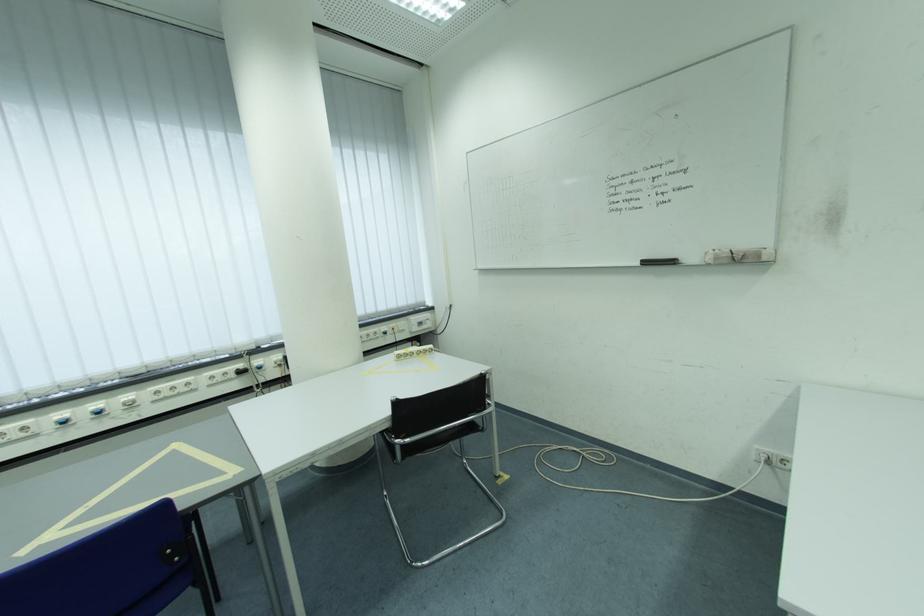
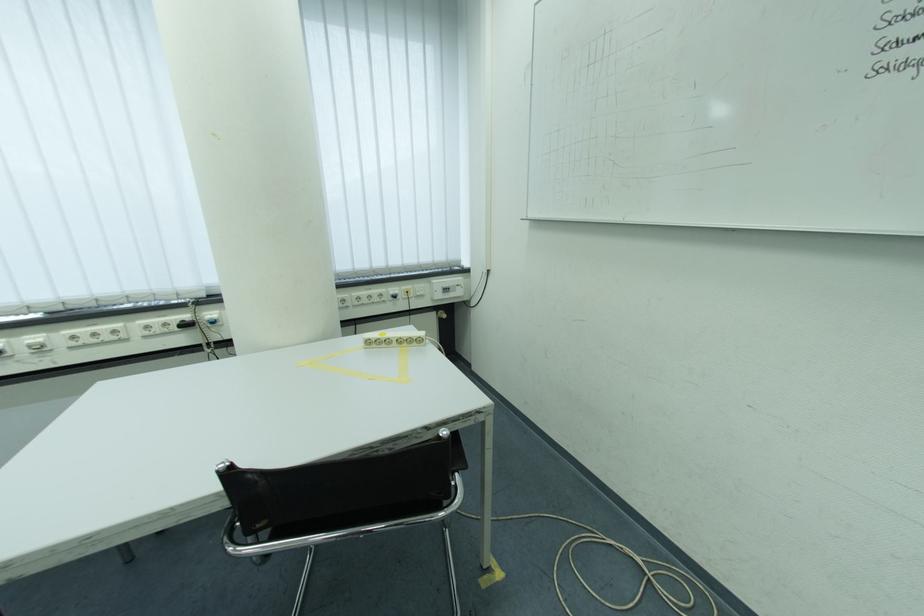
Where in the second image is the point corresponding to point 402,331 from the first image?

(417, 294)